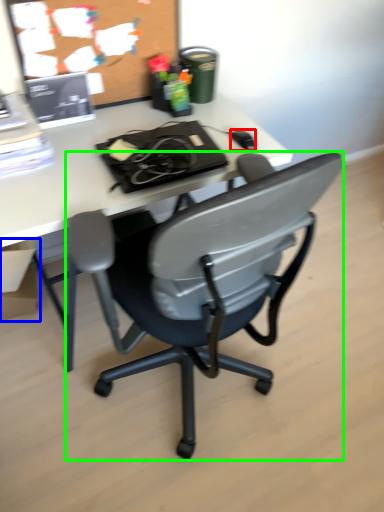
Question: Which object is the closest to the mouse (highlighted by a red box)? Choose among these: box (highlighted by a blue box) or chair (highlighted by a green box).

Choices:
 (A) box
 (B) chair

Answer: (B)